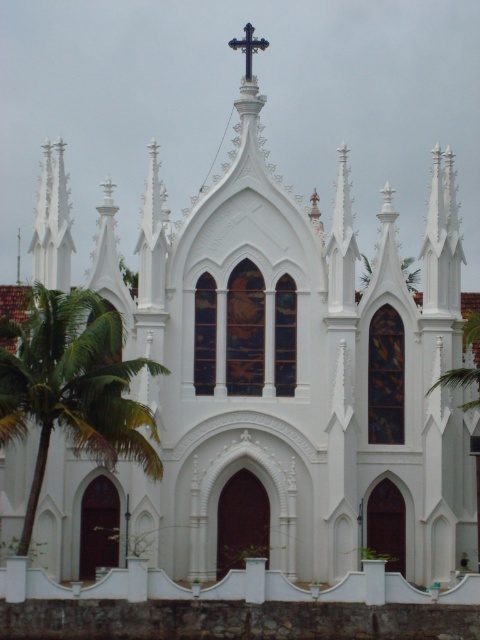
You are standing in front of the Gothic church and want to take a photo that includes both green leafy palm tree at left and green leafy palm tree at right. Which palm tree should you frame closer to the edge of the photo to ensure both are visible?

You should frame the green leafy palm tree at right closer to the edge of the photo because it is smaller in size than the green leafy palm tree at left, allowing both to fit within the frame.

You are standing in front of the church and notice a point marked at coordinates (72, 385). Based on the scene description, what object is located at that point?

The point at coordinates (72, 385) indicates a green leafy palm tree at left.